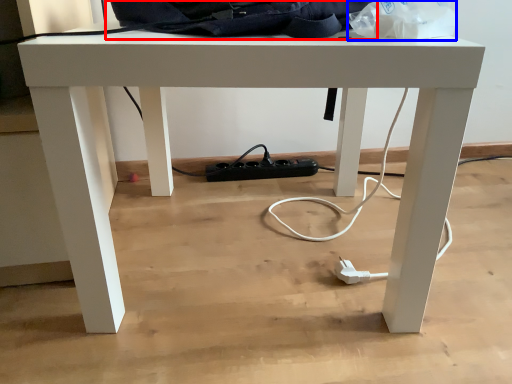
Question: Among these objects, which one is farthest to the camera, messenger bag (highlighted by a red box) or paper bag (highlighted by a blue box)?

Choices:
 (A) messenger bag
 (B) paper bag

Answer: (A)